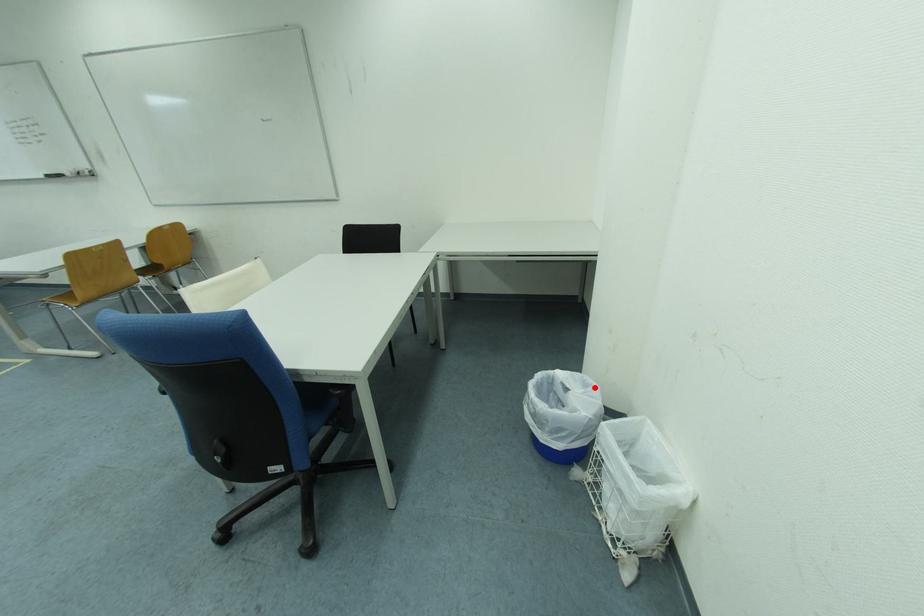
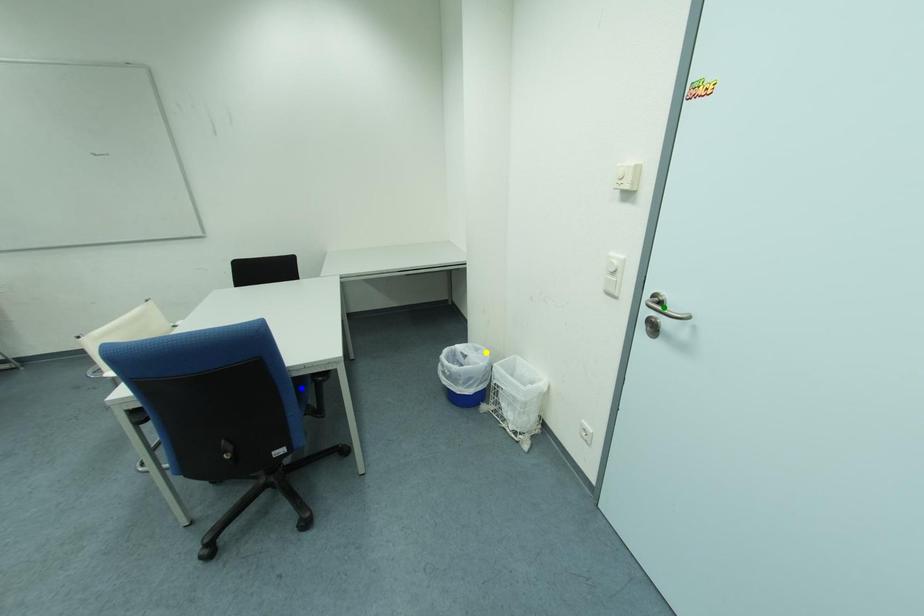
Question: I am providing you with two images of the same scene from different viewpoints. A red point is marked on the first image. You are given multiple points on the second image. Which point in image 2 is actually the same real-world point as the red point in image 1?

Choices:
 (A) green point
 (B) yellow point
 (C) blue point

Answer: (B)